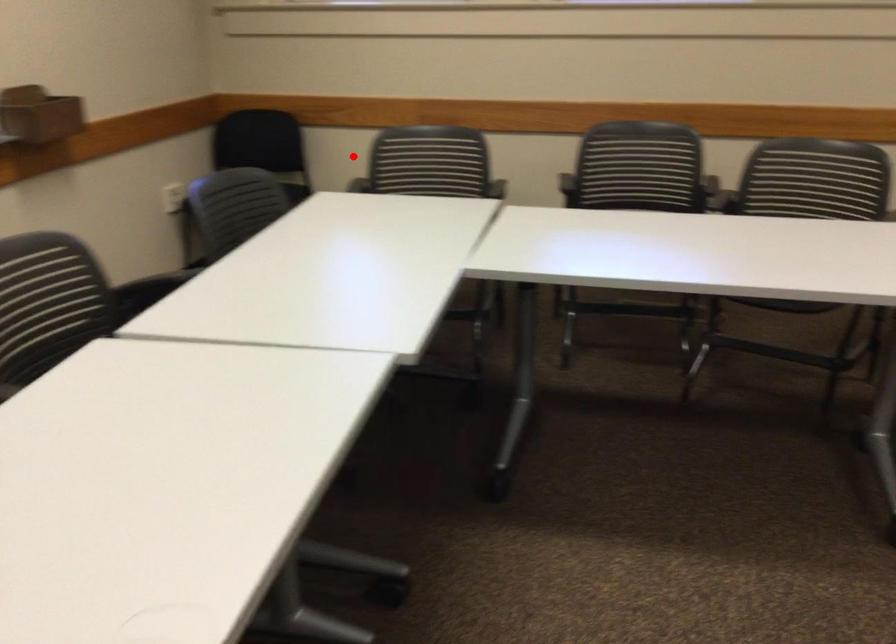
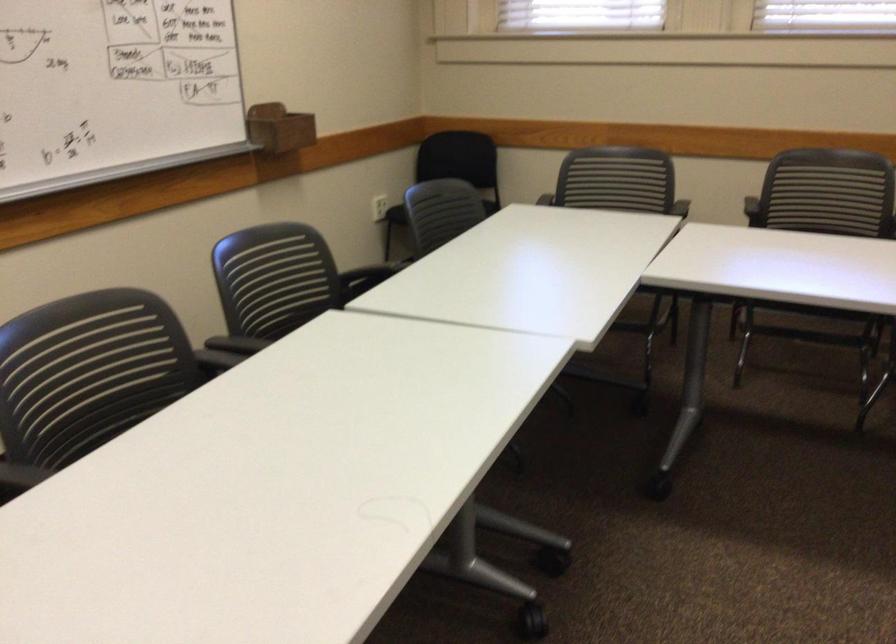
The point at the highlighted location is marked in the first image. Where is the corresponding point in the second image?

(532, 175)